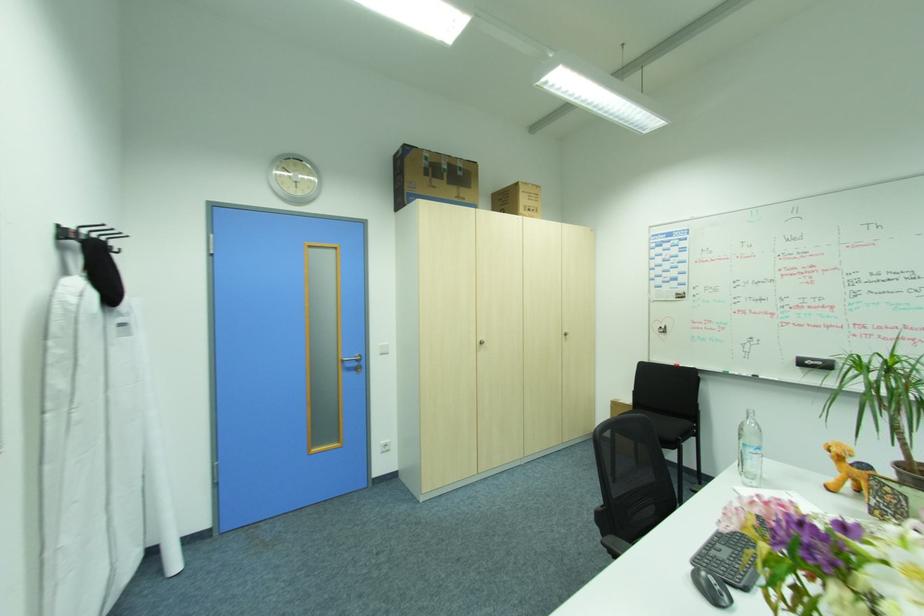
Where would you hang the black coat hook? Please return your answer as a coordinate pair (x, y).

(91, 235)